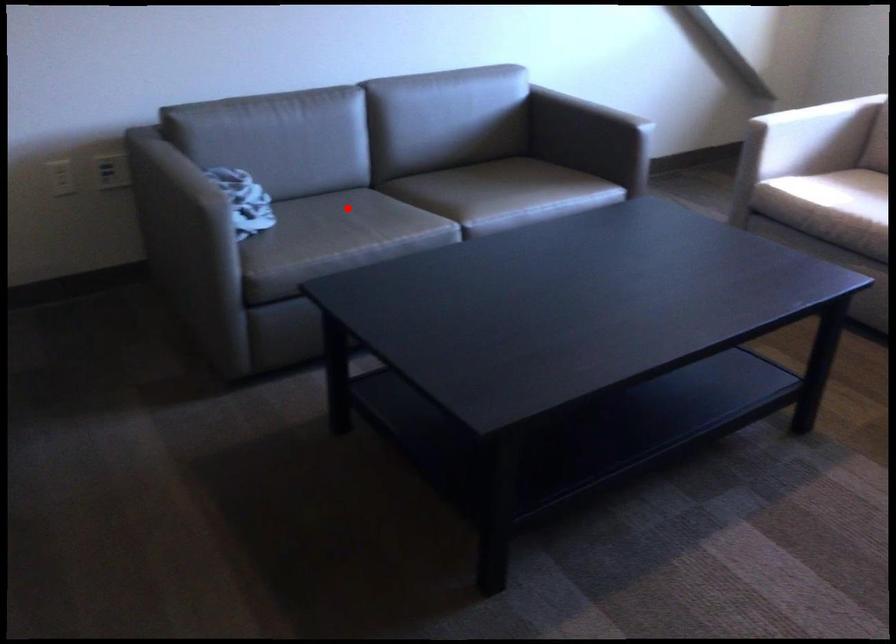
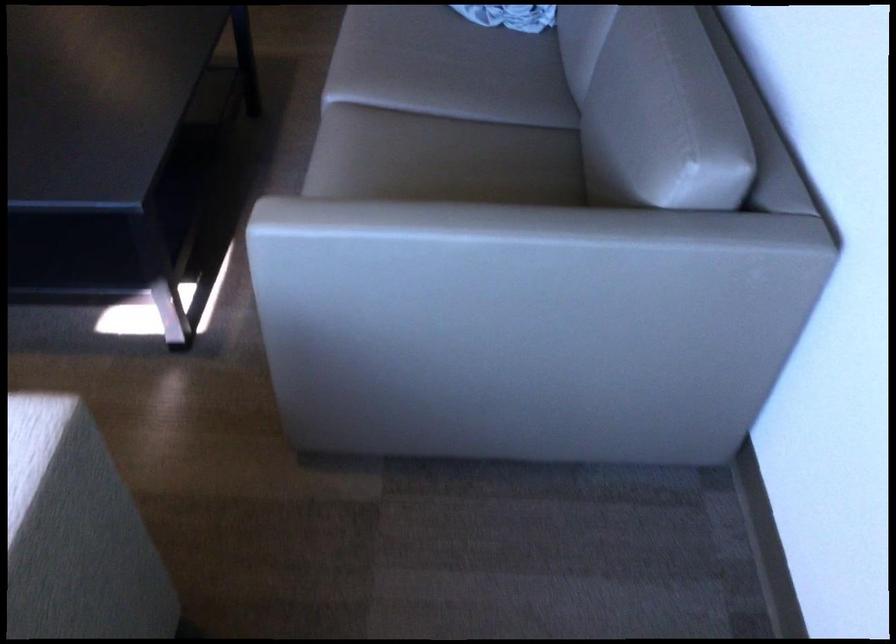
Question: I am providing you with two images of the same scene from different viewpoints. Image1 has a red point marked. In image2, the corresponding 3D location appears at what relative position? Reply with the corresponding letter.

Choices:
 (A) Closer
 (B) Farther

Answer: (A)